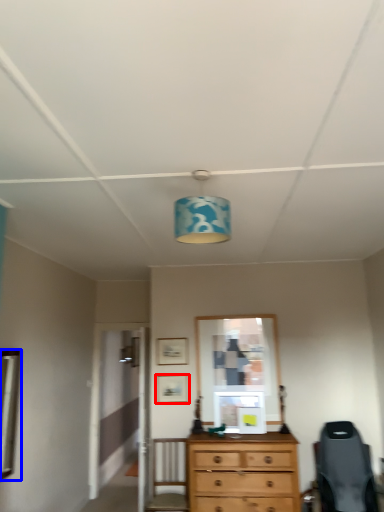
Question: Which of the following is the farthest to the observer, picture frame (highlighted by a red box) or mirror (highlighted by a blue box)?

Choices:
 (A) picture frame
 (B) mirror

Answer: (A)